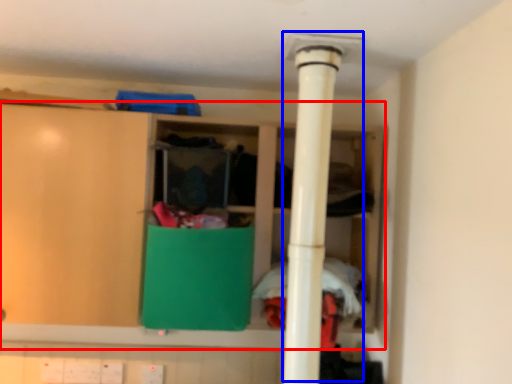
Question: Among these objects, which one is farthest to the camera, cupboard (highlighted by a red box) or water heater (highlighted by a blue box)?

Choices:
 (A) cupboard
 (B) water heater

Answer: (A)